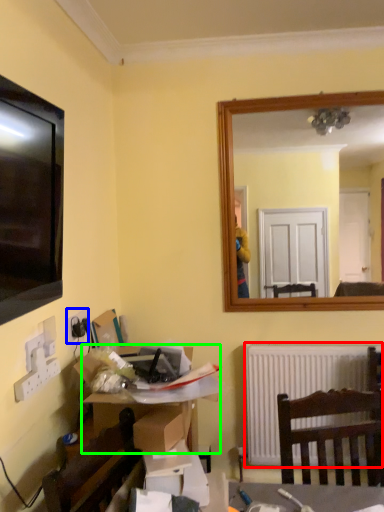
Question: Considering the real-world distances, which object is closest to radiator (highlighted by a red box)? electric outlet (highlighted by a blue box) or desk (highlighted by a green box).

Choices:
 (A) electric outlet
 (B) desk

Answer: (B)